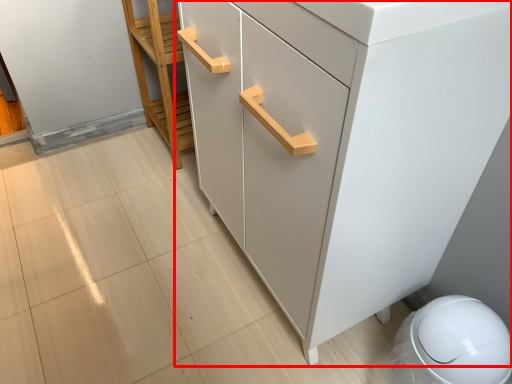
Question: From the image's perspective, where is chest of drawers (annotated by the red box) located in relation to furniture in the image?

Choices:
 (A) below
 (B) above

Answer: (A)